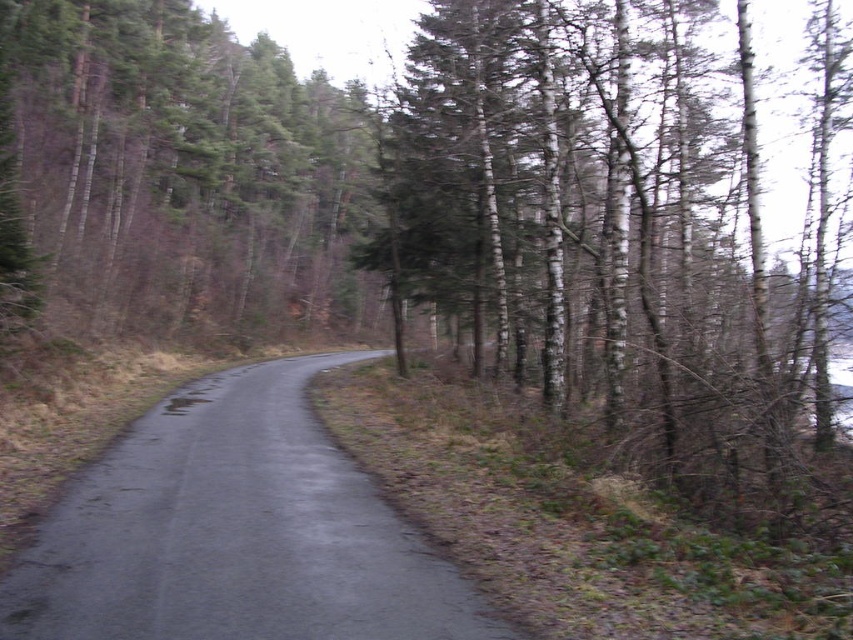
Who is positioned more to the right, green textured pine trees at upper left or black asphalt road at center?

black asphalt road at center is more to the right.

This screenshot has width=853, height=640. What do you see at coordinates (184, 173) in the screenshot? I see `green textured pine trees at upper left` at bounding box center [184, 173].

Which is in front, point (271, 106) or point (227, 595)?

Point (227, 595) is more forward.

In order to click on green textured pine trees at upper left in this screenshot , I will do `click(184, 173)`.

Does smooth white bark trees at right appear on the right side of black asphalt road at center?

Correct, you'll find smooth white bark trees at right to the right of black asphalt road at center.

Which is above, smooth white bark trees at right or black asphalt road at center?

smooth white bark trees at right is above.

Between point (404, 136) and point (386, 636), which one is positioned behind?

Point (404, 136)

Find the location of a particular element. This screenshot has height=640, width=853. smooth white bark trees at right is located at coordinates (607, 237).

Measure the distance from smooth white bark trees at right to green textured pine trees at upper left.

smooth white bark trees at right is 12.95 meters away from green textured pine trees at upper left.

Image resolution: width=853 pixels, height=640 pixels. What are the coordinates of `smooth white bark trees at right` in the screenshot? It's located at (607, 237).

Who is more forward, [747,404] or [155,144]?

Point [747,404]

The height and width of the screenshot is (640, 853). In order to click on smooth white bark trees at right in this screenshot , I will do `click(607, 237)`.